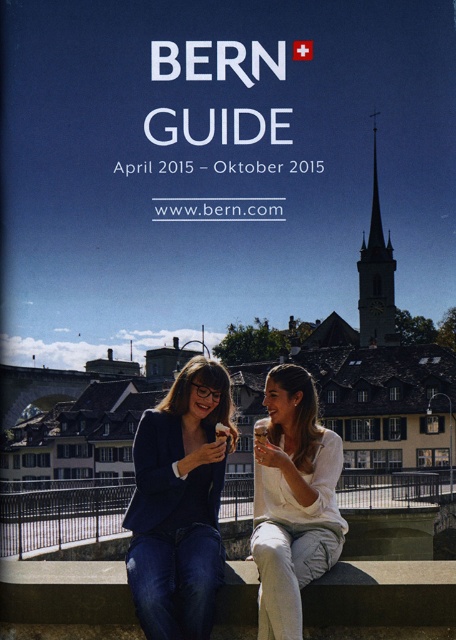
Question: Does matte black blazer at center have a smaller size compared to black concrete ledge at lower center?

Choices:
 (A) no
 (B) yes

Answer: (B)

Question: Can you confirm if black concrete ledge at lower center is positioned above white cotton shirt at center?

Choices:
 (A) no
 (B) yes

Answer: (A)

Question: Estimate the real-world distances between objects in this image. Which object is closer to the black concrete ledge at lower center?

Choices:
 (A) matte black blazer at center
 (B) translucent glass beverage at center

Answer: (A)

Question: Does black concrete ledge at lower center have a greater width compared to white cotton shirt at center?

Choices:
 (A) no
 (B) yes

Answer: (B)

Question: Which object is closer to the camera taking this photo?

Choices:
 (A) black concrete ledge at lower center
 (B) white cotton shirt at center
 (C) translucent glass beverage at center

Answer: (B)

Question: Which point is closer to the camera?

Choices:
 (A) (257, 422)
 (B) (310, 556)

Answer: (B)